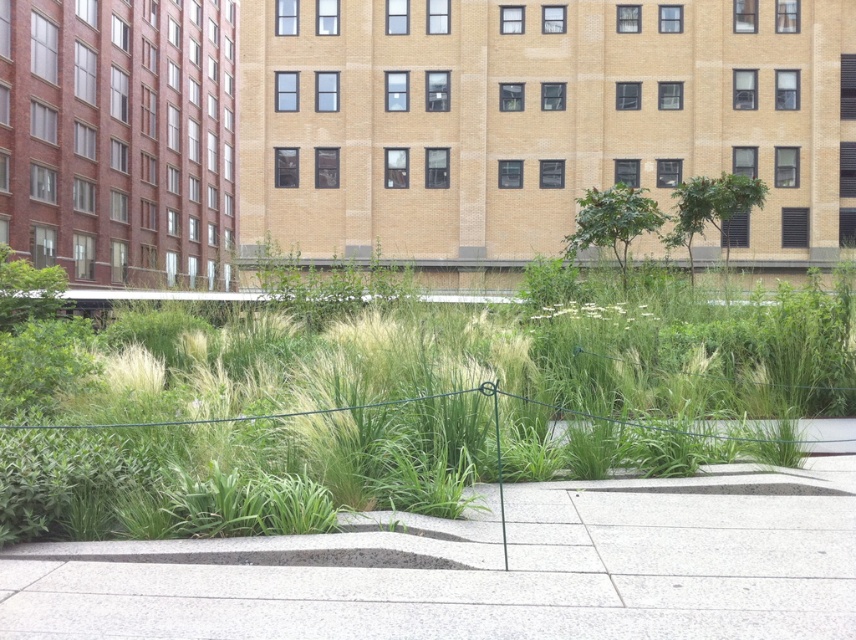
You are standing on the gray concrete pavement at center and want to step onto the green grass at lower left. Considering the height difference between them, will you need to climb up or step down?

The green grass at lower left has a greater height compared to the gray concrete pavement at center, so you will need to climb up to step onto the green grass at lower left.

You are a gardener who needs to plant new flowers in the green grass at lower left and the gray concrete pavement at center. Which area requires more soil because of its size?

The green grass at lower left requires more soil because it is larger in size than the gray concrete pavement at center.

You are standing at the point marked by the coordinates point [391,406] in the image. What is the nearest object to you?

The nearest object to you is the green grass at lower left, as the point [391,406] marks its location.